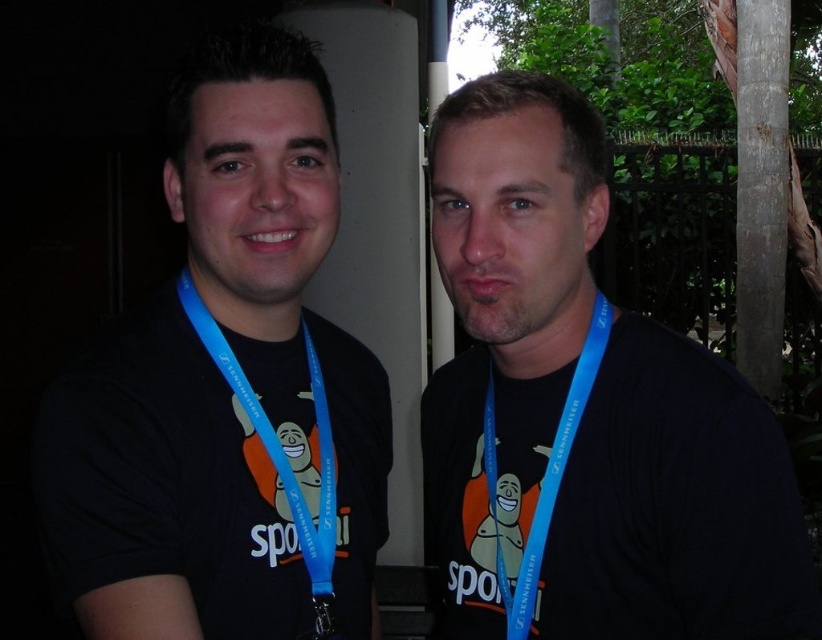
Question: Is black matte t-shirt at left thinner than blue lanyard at left?

Choices:
 (A) no
 (B) yes

Answer: (A)

Question: Does black matte t-shirt at left have a lesser width compared to blue lanyard at left?

Choices:
 (A) no
 (B) yes

Answer: (A)

Question: Estimate the real-world distances between objects in this image. Which object is farther from the blue fabric lanyard at center?

Choices:
 (A) blue lanyard at left
 (B) black matte shirt at center
 (C) black matte t-shirt at left

Answer: (A)

Question: Is blue fabric lanyard at left to the right of matte blue lanyard at center from the viewer's perspective?

Choices:
 (A) yes
 (B) no

Answer: (B)

Question: Which object is the closest to the black matte t-shirt at left?

Choices:
 (A) blue lanyard at left
 (B) blue fabric lanyard at left
 (C) blue fabric lanyard at center
 (D) matte blue lanyard at center

Answer: (B)

Question: Which of the following is the farthest from the observer?

Choices:
 (A) blue lanyard at left
 (B) blue fabric lanyard at center

Answer: (A)